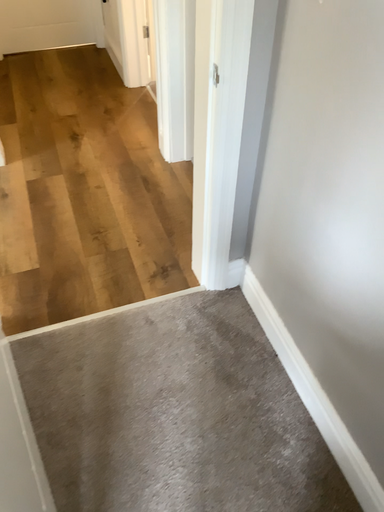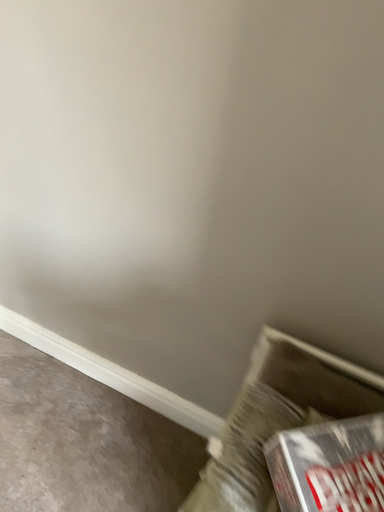
Question: How did the camera likely rotate when shooting the video?

Choices:
 (A) rotated left
 (B) rotated right

Answer: (B)